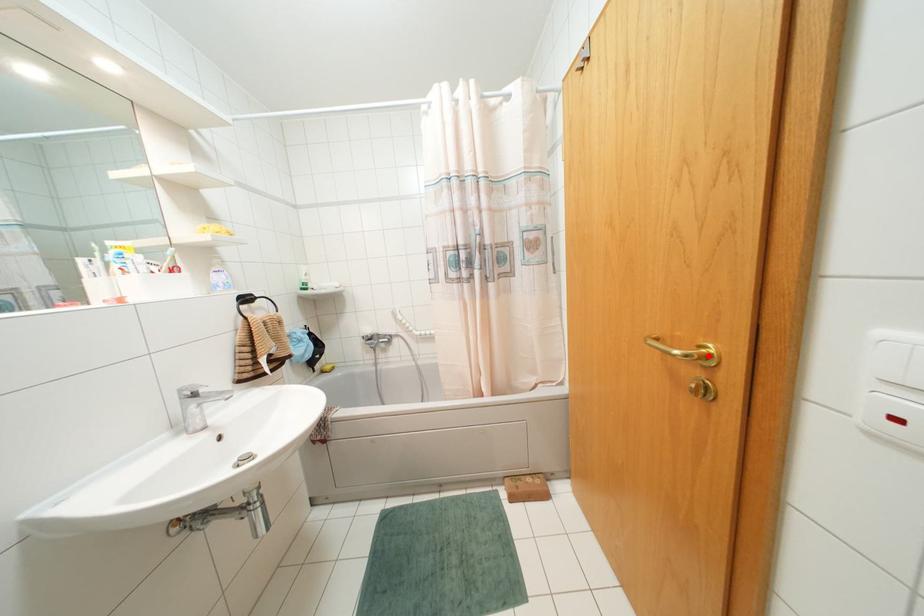
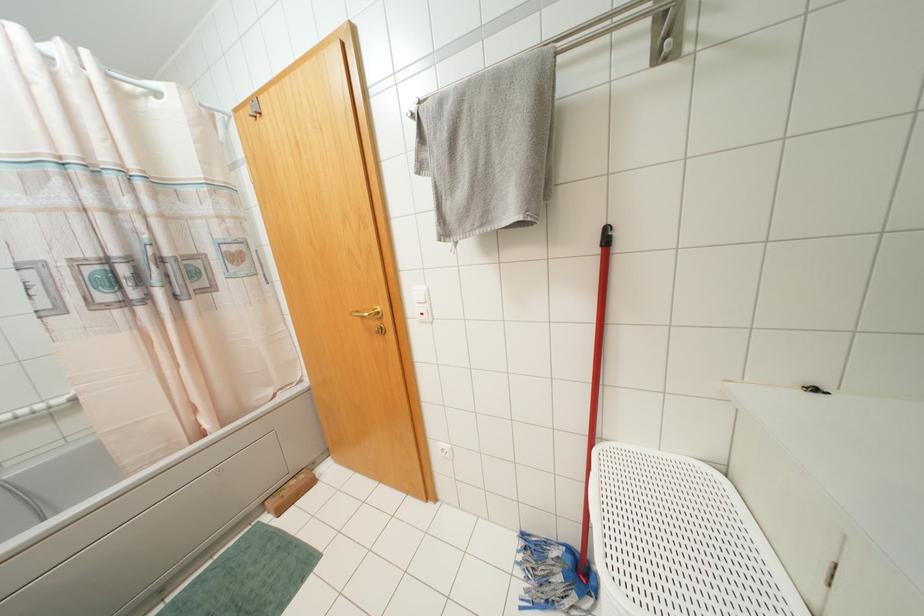
Locate, in the second image, the point that corresponds to the highlighted location in the first image.

(378, 312)